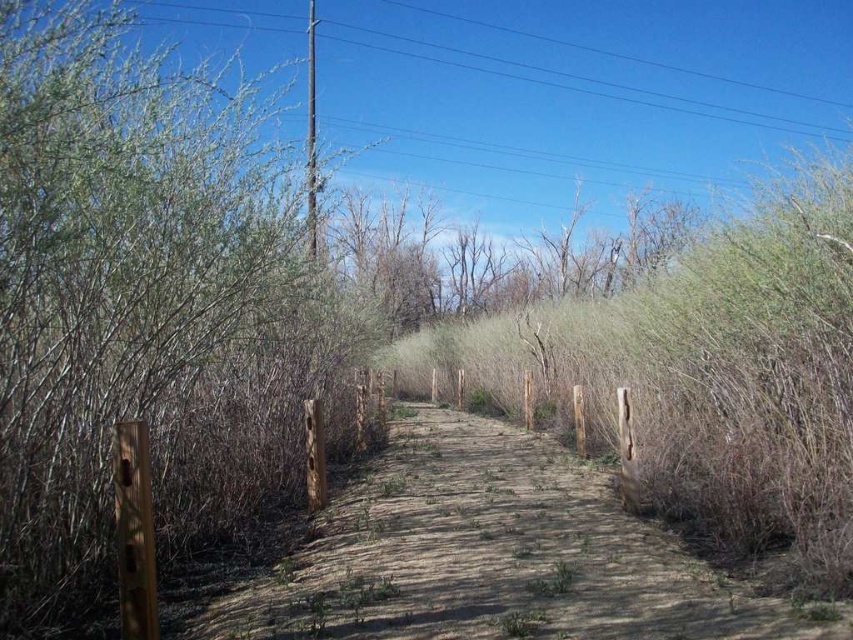
Is green leafy bush at left positioned in front of bare branches at center?

Yes, it is.

Can you confirm if green leafy bush at left is bigger than bare branches at center?

Indeed, green leafy bush at left has a larger size compared to bare branches at center.

Does point (337, 429) come behind point (605, 252)?

No, it is not.

Find the location of `green leafy bush at left`. green leafy bush at left is located at coordinates (144, 305).

Who is positioned more to the left, green leafy bush at left or brown dirt path at center?

green leafy bush at left is more to the left.

Can you confirm if green leafy bush at left is shorter than brown dirt path at center?

Incorrect, green leafy bush at left's height does not fall short of brown dirt path at center's.

Does point (207, 465) come farther from viewer compared to point (706, 620)?

Yes.

The width and height of the screenshot is (853, 640). Identify the location of green leafy bush at left. (144, 305).

Which is above, brown dirt path at center or bare branches at center?

Positioned higher is bare branches at center.

Can you confirm if brown dirt path at center is taller than bare branches at center?

No, brown dirt path at center is not taller than bare branches at center.

Is point (664, 634) positioned after point (489, 252)?

No, it is in front of (489, 252).

Locate an element on the screen. Image resolution: width=853 pixels, height=640 pixels. brown dirt path at center is located at coordinates (495, 556).